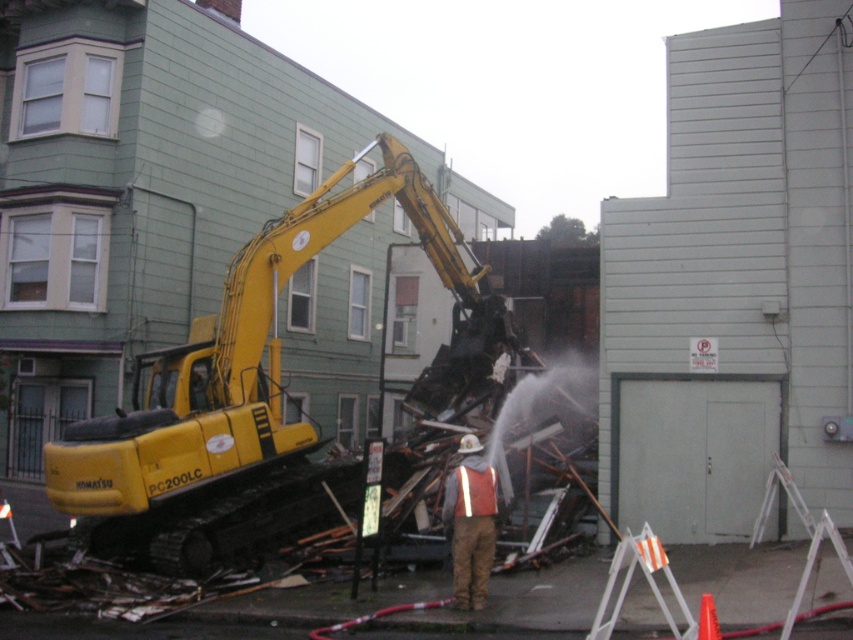
Is point (158, 445) positioned in front of point (494, 490)?

That is False.

Who is positioned more to the right, yellow tracked excavator at left or firefighter uniform at center?

firefighter uniform at center is more to the right.

Is point (486, 316) behind point (490, 493)?

Yes, point (486, 316) is farther from viewer.

You are a GUI agent. You are given a task and a screenshot of the screen. Output one action in this format:
    pyautogui.click(x=<x>, y=<y>)
    Task: Click on the yellow tracked excavator at left
    
    Given the screenshot: What is the action you would take?
    pyautogui.click(x=244, y=388)